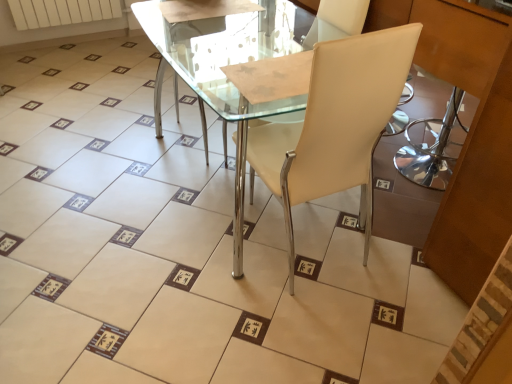
In order to click on vacant region to the left of beige leather chair at center in this screenshot , I will do `click(178, 258)`.